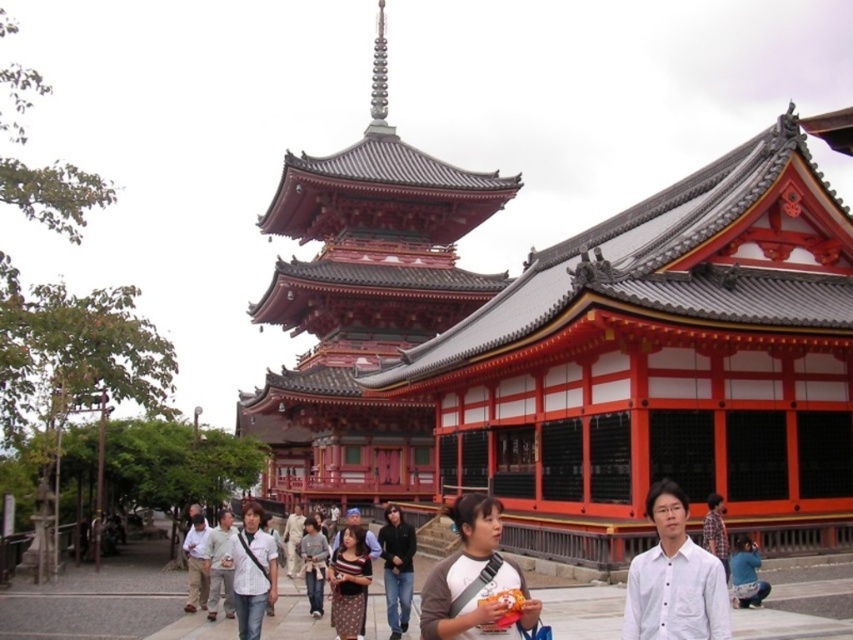
Looking at this image, you are a photographer trying to capture a clear shot of the light gray cotton shirt at center and the gray fabric jacket at center. Since both are in the same area, will you be able to focus on both subjects simultaneously without one blocking the other?

The light gray cotton shirt at center is in front of the gray fabric jacket at center, so focusing on both simultaneously may be challenging as the shirt partially obscures the jacket.

You are standing at point (312, 598) and want to walk to point (218, 561). Given that the path between them is clear, will you have to walk towards the temple or away from it?

Since point (218, 561) is behind point (312, 598), you would need to walk away from the temple to reach it.

You are standing in front of the temple and want to locate two specific points marked on the ground. The first point is at coordinates point (328,580) and the second point is at point (412,568). Which of these two points is nearer to your current position?

Point (328,580) is closer to the viewer than point (412,568).